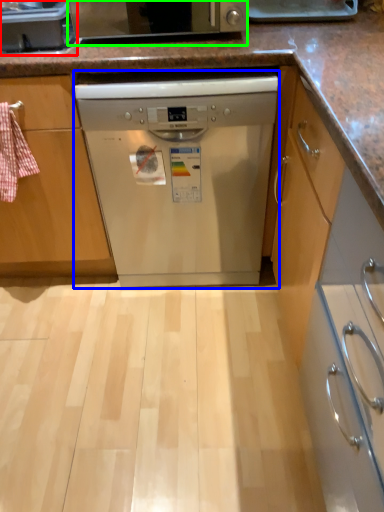
Question: Estimate the real-world distances between objects in this image. Which object is farther from kitchen appliance (highlighted by a red box), dishwasher (highlighted by a blue box) or home appliance (highlighted by a green box)?

Choices:
 (A) dishwasher
 (B) home appliance

Answer: (A)